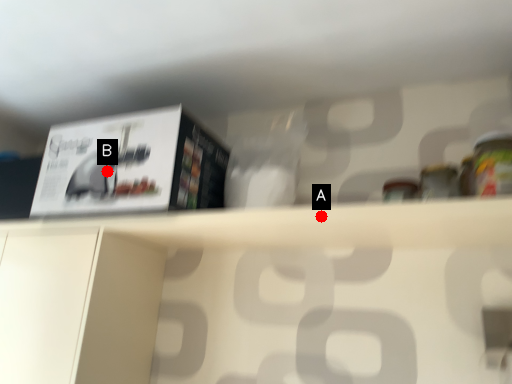
Question: Two points are circled on the image, labeled by A and B beside each circle. Which point is farther from the camera taking this photo?

Choices:
 (A) A is further
 (B) B is further

Answer: (B)